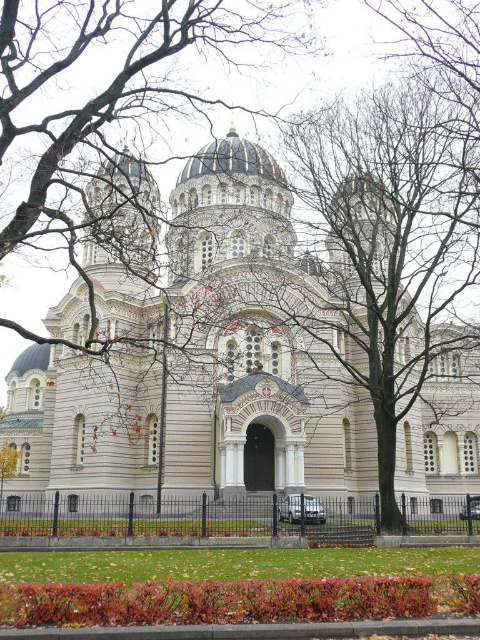
Which is in front, point (228, 432) or point (330, 552)?

Positioned in front is point (330, 552).

Is white stone church at center below green grass at lower center?

Incorrect, white stone church at center is not positioned below green grass at lower center.

Between point (111, 266) and point (203, 547), which one is positioned behind?

The point (111, 266) is behind.

At what (x,y) coordinates should I click in order to perform the action: click on white stone church at center. Please return your answer as a coordinate pair (x, y). The width and height of the screenshot is (480, 640). Looking at the image, I should click on (201, 358).